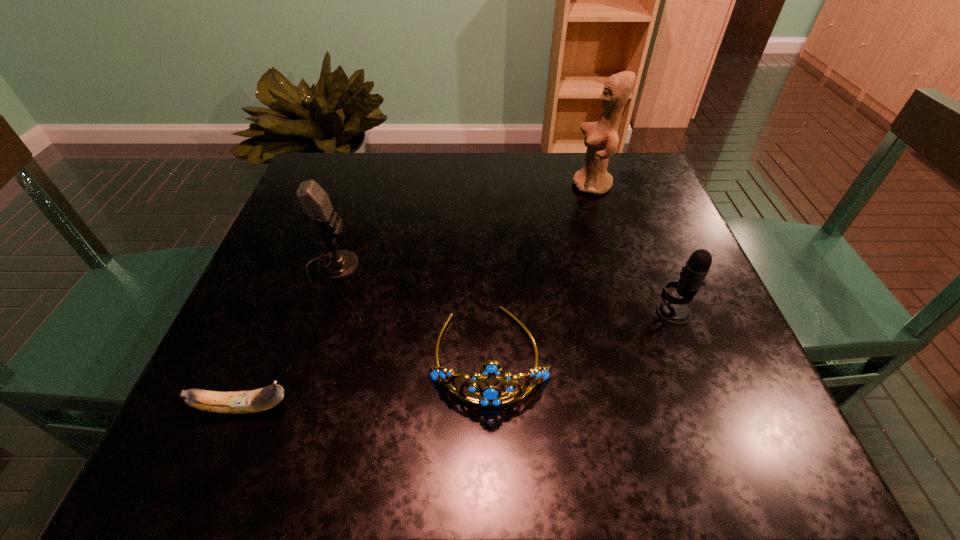
Find the location of a particular element. figurine is located at coordinates (601, 138).

This screenshot has height=540, width=960. In order to click on the tallest object in this screenshot , I will do `click(601, 138)`.

Find the location of a particular element. This screenshot has width=960, height=540. the fourth shortest object is located at coordinates (314, 201).

This screenshot has height=540, width=960. I want to click on the taller microphone, so click(x=314, y=201).

Find the location of `the shorter microphone`. the shorter microphone is located at coordinates (673, 310).

Where is `the nearer microphone`? The height and width of the screenshot is (540, 960). the nearer microphone is located at coordinates (673, 310).

Where is `the third object from right to left`? the third object from right to left is located at coordinates (490, 395).

Where is `the second shortest object`? Image resolution: width=960 pixels, height=540 pixels. the second shortest object is located at coordinates pyautogui.click(x=490, y=395).

Locate an element on the screen. This screenshot has width=960, height=540. banana is located at coordinates (238, 402).

The height and width of the screenshot is (540, 960). In order to click on free space located on the front-facing side of the figurine in this screenshot , I will do `click(446, 185)`.